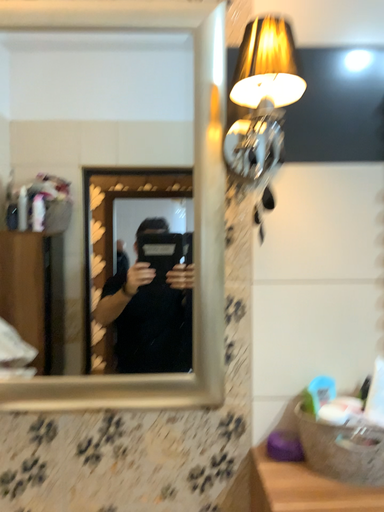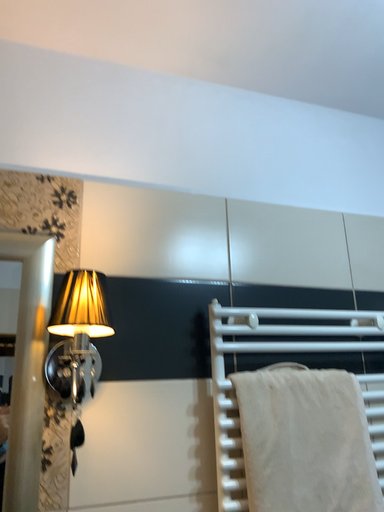
Question: How did the camera likely rotate when shooting the video?

Choices:
 (A) rotated right
 (B) rotated left

Answer: (A)